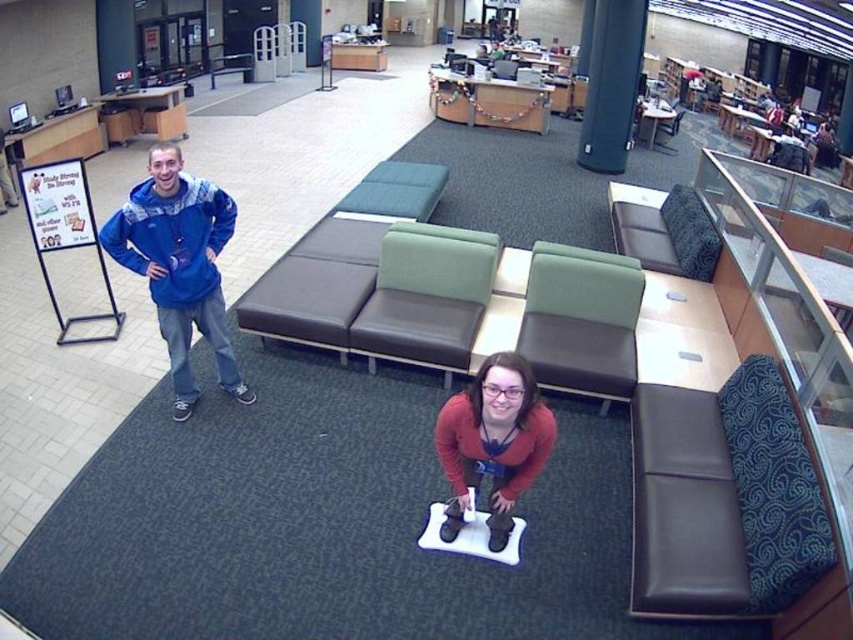
Question: Where is green fabric couch at center located in relation to dark brown leather couch at upper right in the image?

Choices:
 (A) right
 (B) left

Answer: (B)

Question: Is matte red sweater at center to the left of dark brown leather couch at upper right from the viewer's perspective?

Choices:
 (A) yes
 (B) no

Answer: (A)

Question: Which object is the closest to the dark brown leather couch at upper right?

Choices:
 (A) green leather couch at center
 (B) matte red sweater at center
 (C) blue fleece jacket at left
 (D) dark brown leather couch at right

Answer: (A)

Question: Observing the image, what is the correct spatial positioning of matte red sweater at center in reference to dark brown leather couch at upper right?

Choices:
 (A) right
 (B) left

Answer: (B)

Question: Which of these objects is positioned farthest from the green leather couch at center?

Choices:
 (A) green fabric couch at center
 (B) blue fleece jacket at left

Answer: (B)

Question: Estimate the real-world distances between objects in this image. Which object is farther from the green leather couch at center?

Choices:
 (A) dark brown leather couch at right
 (B) matte red sweater at center

Answer: (A)